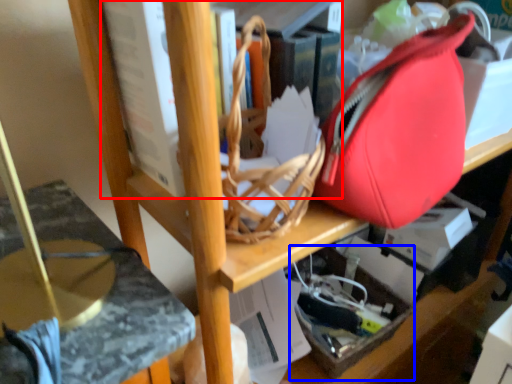
Question: Among these objects, which one is farthest to the camera, book (highlighted by a red box) or box (highlighted by a blue box)?

Choices:
 (A) book
 (B) box

Answer: (B)